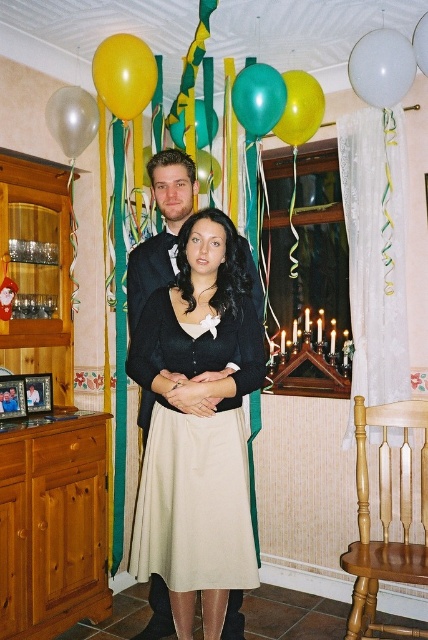
Does green glossy balloon at center appear on the left side of matte green balloon at center?

Indeed, green glossy balloon at center is positioned on the left side of matte green balloon at center.

Does point (178, 136) lie behind point (425, 70)?

That is True.

Is point (196, 144) in front of point (425, 22)?

No, it is behind (425, 22).

Find the location of `green glossy balloon at center`. green glossy balloon at center is located at coordinates point(205,124).

Which of these two, beige pleated skirt at center or green glossy balloon at center, stands taller?

beige pleated skirt at center

Measure the distance between beige pleated skirt at center and camera.

6.43 feet

Is point (219, 481) in front of point (183, 113)?

Yes.

Where is `beige pleated skirt at center`? This screenshot has width=428, height=640. beige pleated skirt at center is located at coordinates (195, 456).

Is light brown wooden chair at lower right smaller than transparent plastic balloon at upper center?

No, light brown wooden chair at lower right is not smaller than transparent plastic balloon at upper center.

Is light brown wooden chair at lower right positioned in front of transparent plastic balloon at upper center?

Yes.

Who is more forward, (386, 525) or (380, 74)?

Point (380, 74) is in front.

You are a GUI agent. You are given a task and a screenshot of the screen. Output one action in this format:
    pyautogui.click(x=<x>, y=<y>)
    Task: Click on the light brown wooden chair at lower right
    The image size is (428, 640).
    Given the screenshot: What is the action you would take?
    pyautogui.click(x=386, y=516)